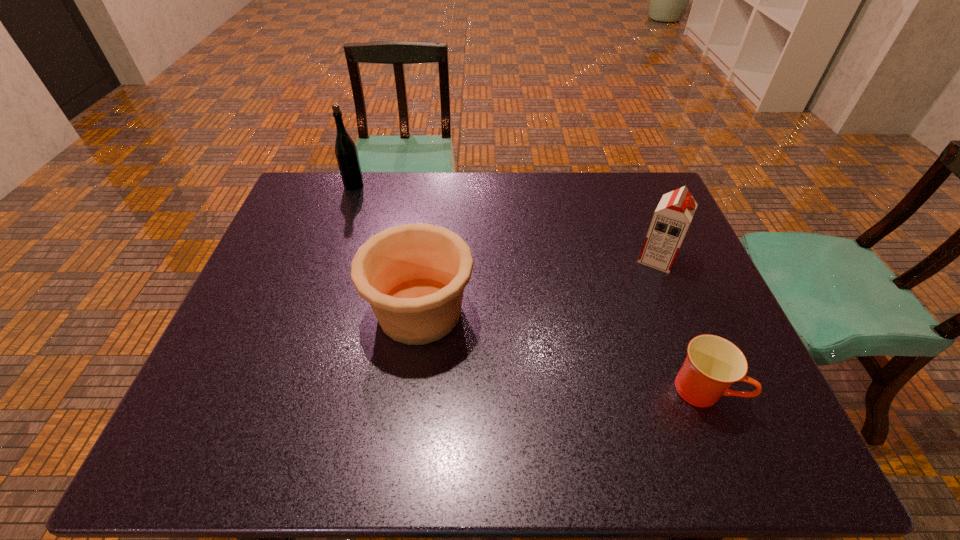
This screenshot has width=960, height=540. In order to click on beer bottle in this screenshot , I will do `click(346, 152)`.

Where is `the farthest object`? the farthest object is located at coordinates (346, 152).

This screenshot has height=540, width=960. What are the coordinates of `the third shortest object` in the screenshot? It's located at [x=672, y=217].

This screenshot has width=960, height=540. In order to click on soya milk in this screenshot , I will do (x=672, y=217).

You are a GUI agent. You are given a task and a screenshot of the screen. Output one action in this format:
    pyautogui.click(x=<x>, y=<y>)
    Task: Click on the third object from right to left
    This screenshot has width=960, height=540.
    Given the screenshot: What is the action you would take?
    pyautogui.click(x=413, y=275)

Identify the location of the third farthest object. The height and width of the screenshot is (540, 960). (413, 275).

Find the location of a particular element. This screenshot has width=960, height=540. the shortest object is located at coordinates (713, 364).

I want to click on the nearest object, so click(x=713, y=364).

Identify the location of vacant space situated 0.370m on the right of the farthest object. The height and width of the screenshot is (540, 960). (474, 185).

The width and height of the screenshot is (960, 540). I want to click on vacant space situated 0.230m on the front of the soya milk, so click(691, 343).